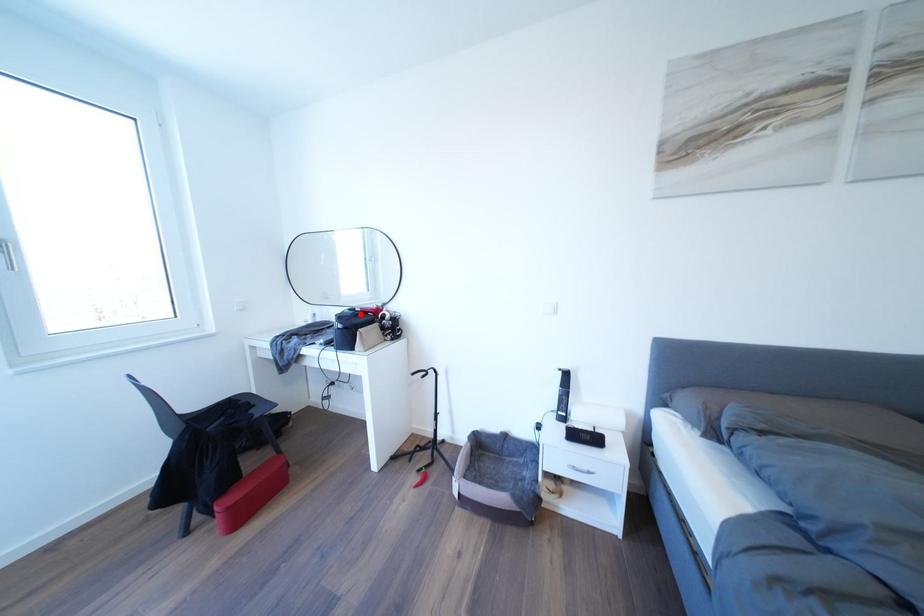
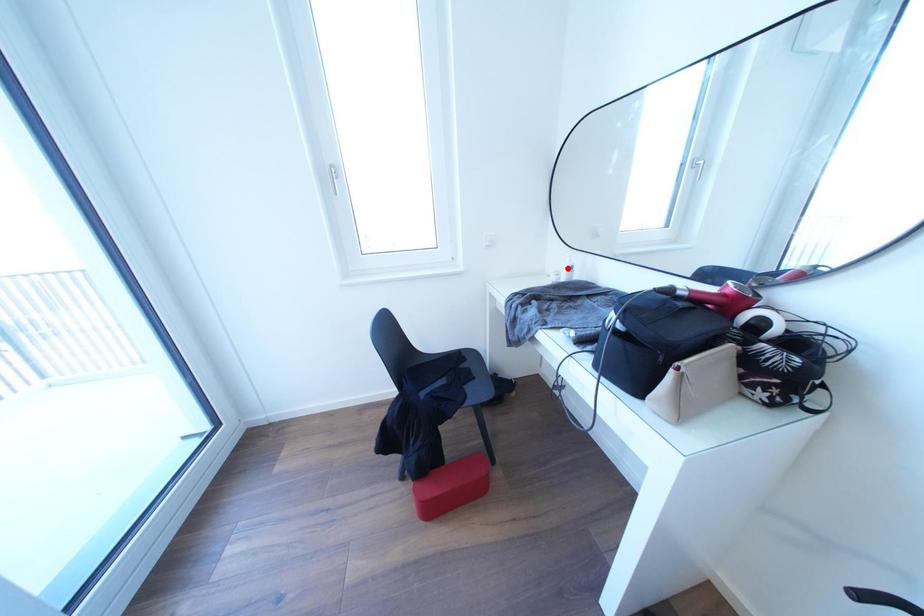
I am providing you with two images of the same scene from different viewpoints. A red point is marked on the first image and another point is marked on the second image. Are the points marked in image1 and image2 representing the same 3D position?

No